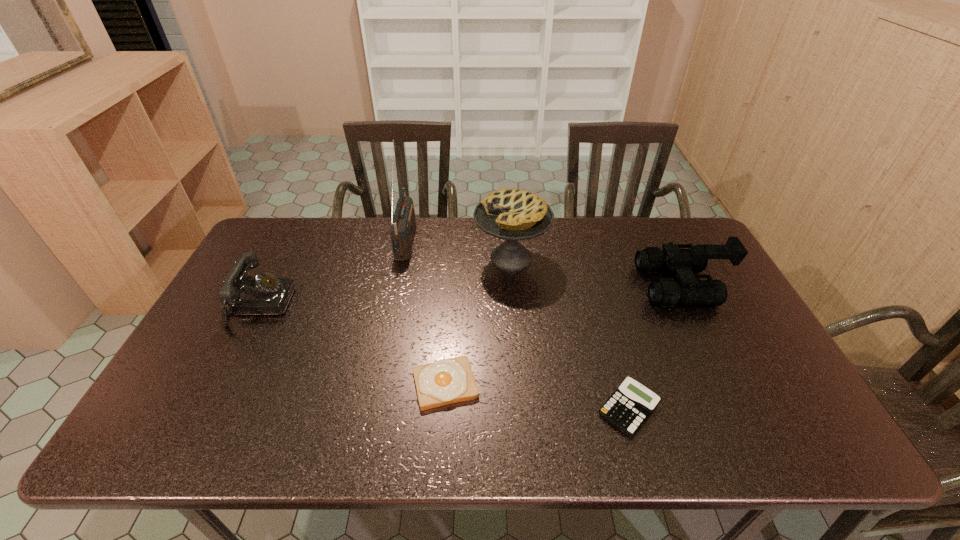
Identify which object is the fourth nearest to the second object from left to right. Please provide its 2D coordinates. Your answer should be formatted as a tuple, i.e. [(x, y)], where the tuple contains the x and y coordinates of a point satisfying the conditions above.

[(628, 408)]

This screenshot has height=540, width=960. Find the location of `vacant space that satisfies the following two spatial constraints: 1. on the front-facing side of the second object from left to right; 2. on the left side of the calculator`. vacant space that satisfies the following two spatial constraints: 1. on the front-facing side of the second object from left to right; 2. on the left side of the calculator is located at coordinates (372, 409).

Where is `vacant position in the image that satisfies the following two spatial constraints: 1. on the back side of the calculator; 2. on the dial of the third shortest object`? vacant position in the image that satisfies the following two spatial constraints: 1. on the back side of the calculator; 2. on the dial of the third shortest object is located at coordinates (599, 305).

The width and height of the screenshot is (960, 540). I want to click on free spot that satisfies the following two spatial constraints: 1. on the dial of the calculator; 2. on the left side of the third shortest object, so click(206, 409).

You are a GUI agent. You are given a task and a screenshot of the screen. Output one action in this format:
    pyautogui.click(x=<x>, y=<y>)
    Task: Click on the vacant space that satisfies the following two spatial constraints: 1. on the dial of the telephone; 2. on the left side of the toast
    
    Given the screenshot: What is the action you would take?
    pyautogui.click(x=219, y=384)

The image size is (960, 540). What are the coordinates of `vacant area that satisfies the following two spatial constraints: 1. on the front-facing side of the tallest object; 2. on the back side of the second object from right to left` in the screenshot? It's located at (372, 409).

This screenshot has height=540, width=960. Find the location of `vacant space that satisfies the following two spatial constraints: 1. on the front lenses of the rightmost object; 2. on the front side of the calculator`. vacant space that satisfies the following two spatial constraints: 1. on the front lenses of the rightmost object; 2. on the front side of the calculator is located at coordinates (744, 409).

Find the location of `vacant space that satisfies the following two spatial constraints: 1. on the front lenses of the third tallest object; 2. on the front side of the toast`. vacant space that satisfies the following two spatial constraints: 1. on the front lenses of the third tallest object; 2. on the front side of the toast is located at coordinates (732, 384).